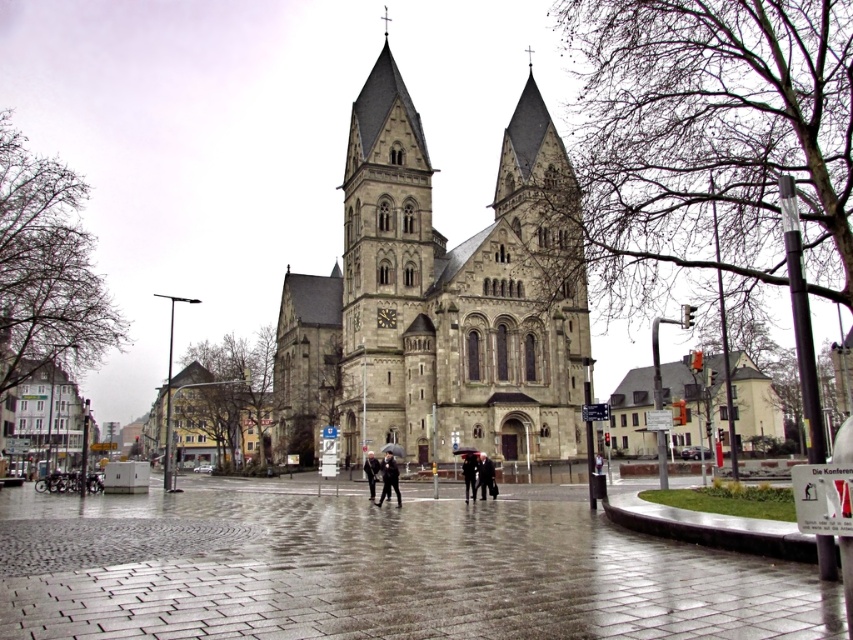
Between gray stone church at center and dark gray coat at center, which one is positioned lower?

dark gray coat at center is lower down.

Can you confirm if gray stone church at center is positioned to the left of dark gray coat at center?

Incorrect, gray stone church at center is not on the left side of dark gray coat at center.

Is point (396, 332) in front of point (389, 486)?

No.

Locate an element on the screen. gray stone church at center is located at coordinates (440, 301).

Can you confirm if gray stone church at center is bigger than dark gray suit at center?

Yes.

Can you confirm if gray stone church at center is thinner than dark gray suit at center?

Incorrect, gray stone church at center's width is not less than dark gray suit at center's.

Is point (403, 417) less distant than point (469, 493)?

No.

Image resolution: width=853 pixels, height=640 pixels. Find the location of `gray stone church at center`. gray stone church at center is located at coordinates (440, 301).

Between gray stone church at center and dark gray fabric umbrella at center, which one appears on the left side from the viewer's perspective?

Positioned to the left is gray stone church at center.

Is gray stone church at center to the left of dark gray fabric umbrella at center from the viewer's perspective?

Correct, you'll find gray stone church at center to the left of dark gray fabric umbrella at center.

What are the coordinates of `gray stone church at center` in the screenshot? It's located at pos(440,301).